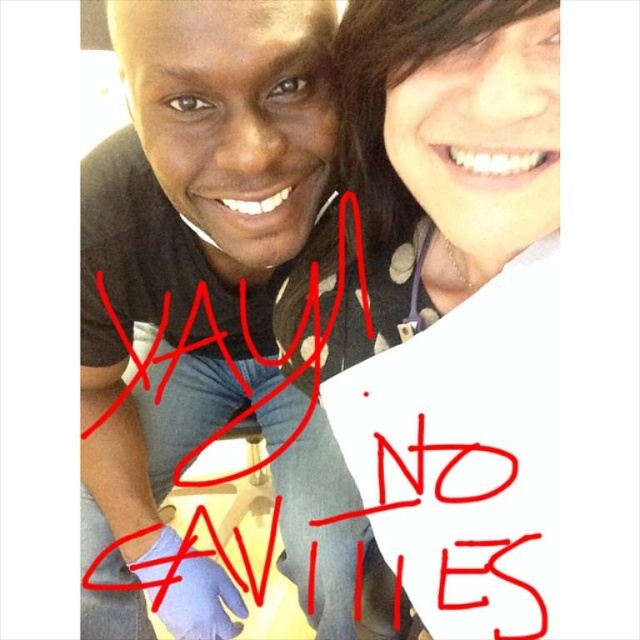
Question: Among these objects, which one is farthest from the camera?

Choices:
 (A) matte black shirt at upper left
 (B) matte white paper at upper right

Answer: (A)

Question: Does matte black shirt at upper left have a smaller size compared to matte white paper at upper right?

Choices:
 (A) yes
 (B) no

Answer: (B)

Question: Among these points, which one is farthest from the camera?

Choices:
 (A) (200, 413)
 (B) (342, 67)

Answer: (A)

Question: Does matte black shirt at upper left have a smaller size compared to matte white paper at upper right?

Choices:
 (A) yes
 (B) no

Answer: (B)

Question: Does matte black shirt at upper left lie behind matte white paper at upper right?

Choices:
 (A) no
 (B) yes

Answer: (B)